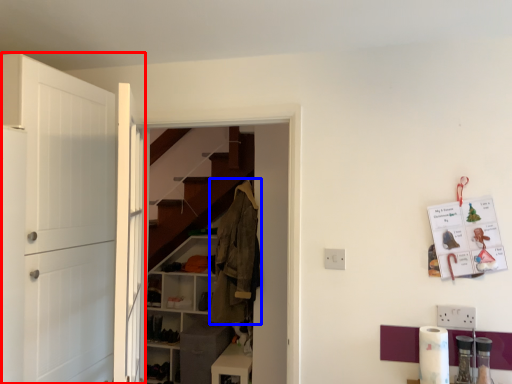
Question: Which object appears closest to the camera in this image, door (highlighted by a red box) or clothing (highlighted by a blue box)?

Choices:
 (A) door
 (B) clothing

Answer: (A)